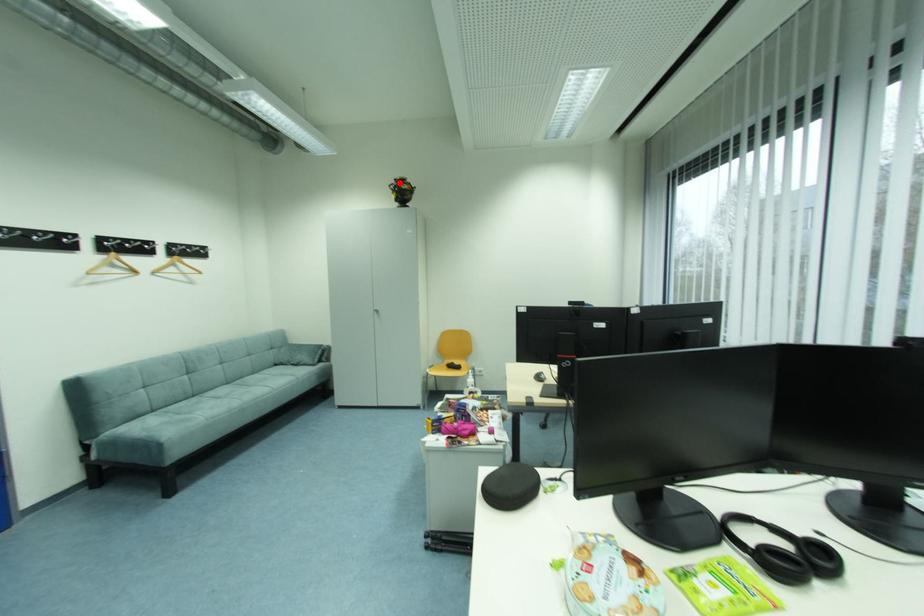
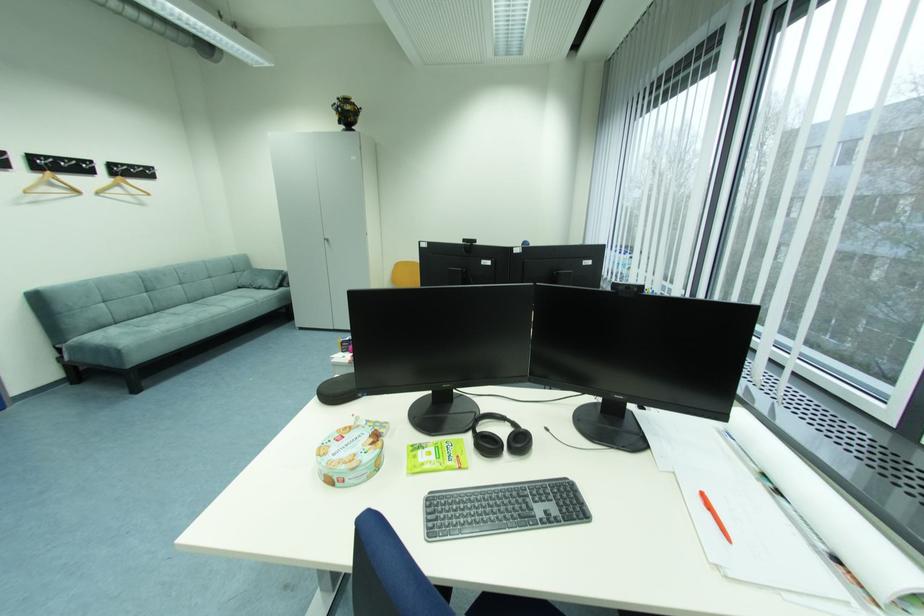
In the second image, find the point that corresponds to the highlighted location in the first image.

(344, 103)